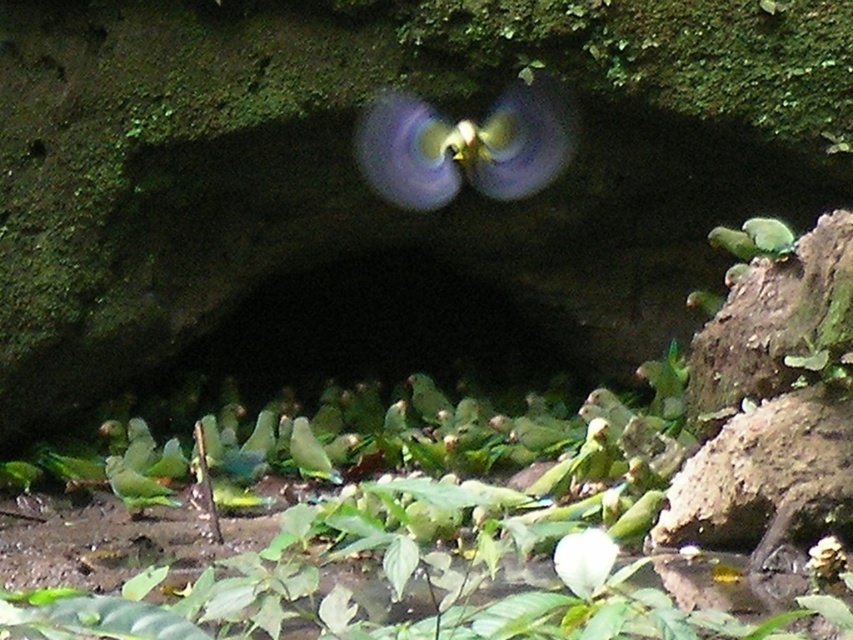
Question: Is green leafy plant at center above blurred green parrot at center?

Choices:
 (A) no
 (B) yes

Answer: (A)

Question: Which point is farther from the camera taking this photo?

Choices:
 (A) (378, 168)
 (B) (544, 513)

Answer: (A)

Question: Is green leafy plant at center above blurred green parrot at center?

Choices:
 (A) no
 (B) yes

Answer: (A)

Question: Among these points, which one is nearest to the camera?

Choices:
 (A) (519, 120)
 (B) (624, 568)

Answer: (B)

Question: Among these objects, which one is farthest from the camera?

Choices:
 (A) blurred green parrot at center
 (B) green leafy plant at center

Answer: (A)

Question: Does green leafy plant at center appear under blurred green parrot at center?

Choices:
 (A) yes
 (B) no

Answer: (A)